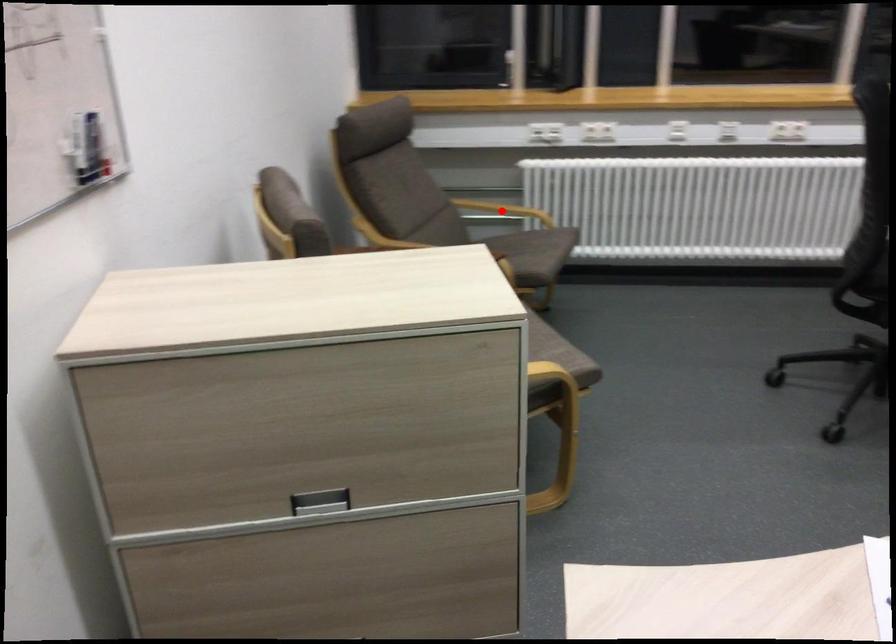
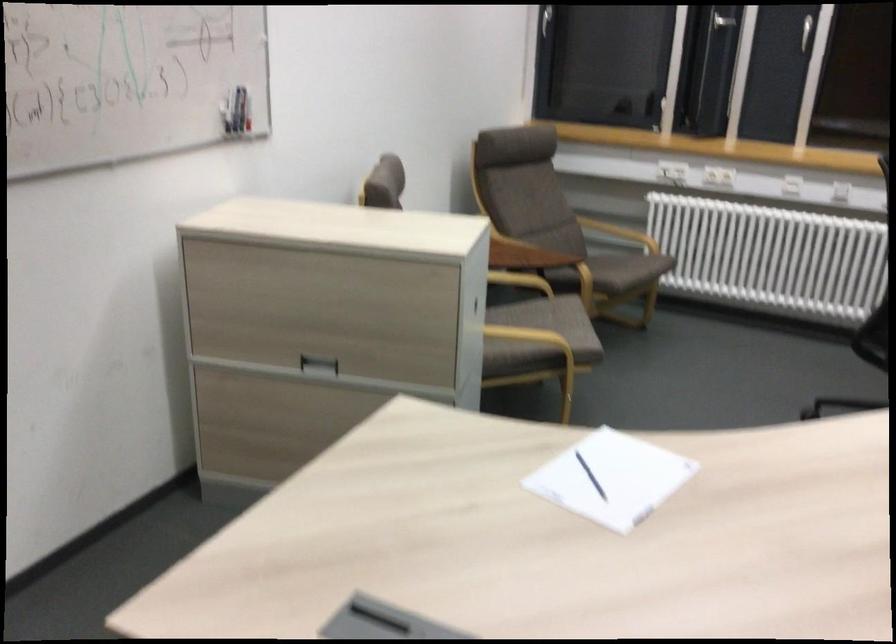
The point at the highlighted location is marked in the first image. Where is the corresponding point in the second image?

(619, 232)